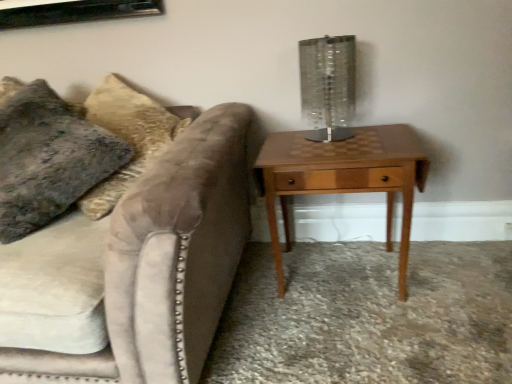
Locate an element on the screen. Image resolution: width=512 pixels, height=384 pixels. free space in front of clear glass table lamp at upper right is located at coordinates (328, 155).